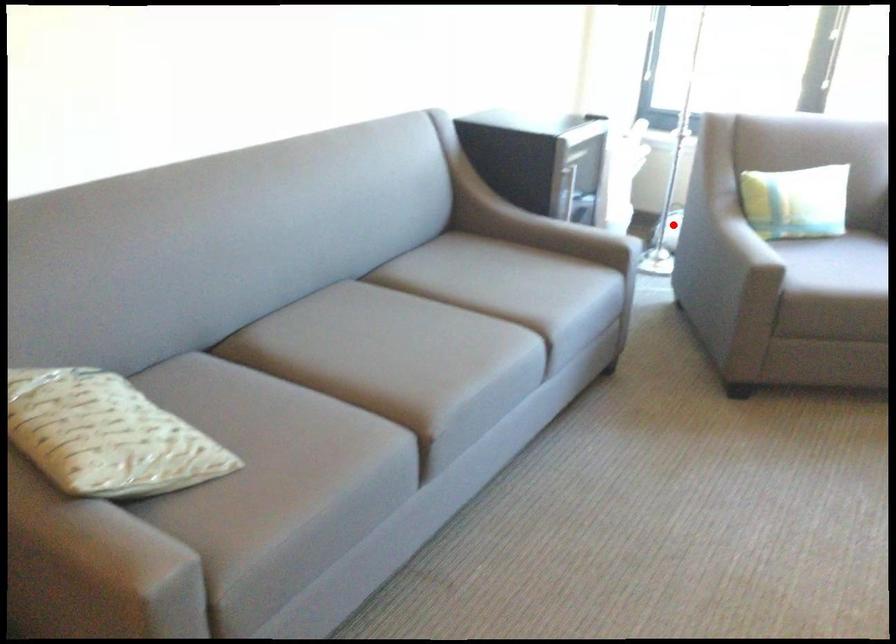
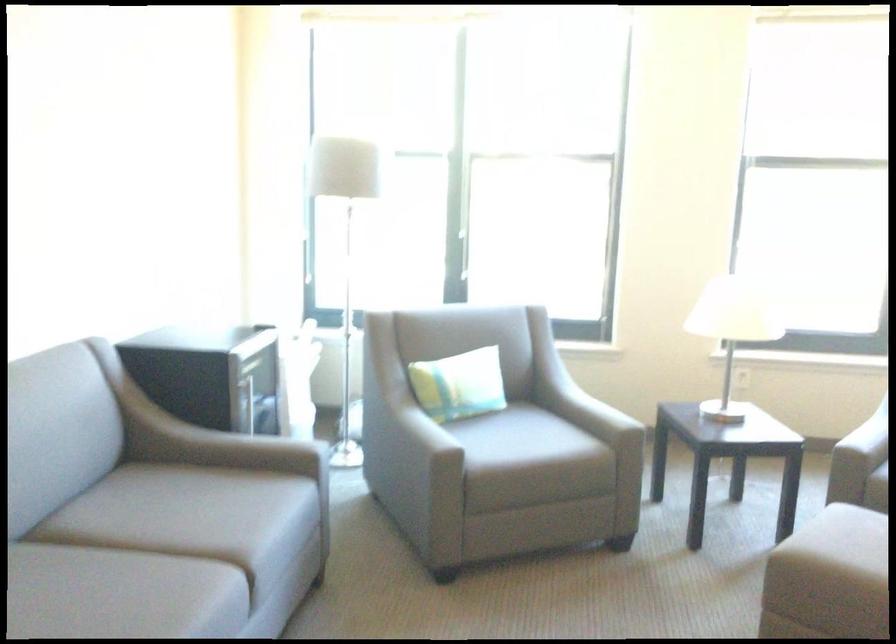
Where in the second image is the point corresponding to the highlighted location from the first image?

(356, 420)